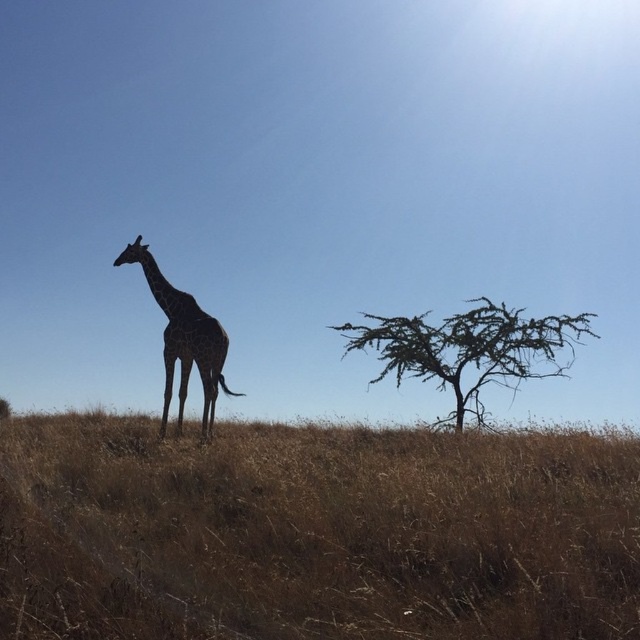
Question: Estimate the real-world distances between objects in this image. Which object is closer to the spotted fur giraffe at center?

Choices:
 (A) dry grass at center
 (B) brown textured tree at right

Answer: (B)

Question: Can you confirm if brown textured tree at right is positioned below spotted fur giraffe at center?

Choices:
 (A) no
 (B) yes

Answer: (B)

Question: Which point is farther to the camera?

Choices:
 (A) spotted fur giraffe at center
 (B) dry grass at center
 (C) brown textured tree at right

Answer: (C)

Question: Does dry grass at center appear on the left side of spotted fur giraffe at center?

Choices:
 (A) yes
 (B) no

Answer: (B)

Question: Is dry grass at center bigger than spotted fur giraffe at center?

Choices:
 (A) yes
 (B) no

Answer: (B)

Question: Which of the following is the closest to the observer?

Choices:
 (A) brown textured tree at right
 (B) spotted fur giraffe at center

Answer: (B)